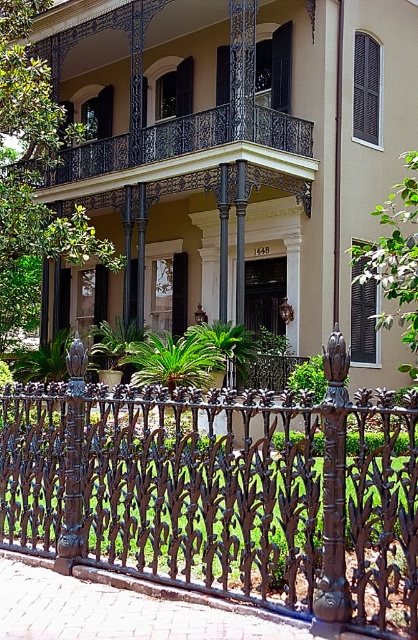
Question: Which of the following is the farthest from the observer?

Choices:
 (A) (306, 189)
 (B) (336, 388)

Answer: (A)

Question: Among these points, which one is farthest from the camera?

Choices:
 (A) (160, 147)
 (B) (333, 420)

Answer: (A)

Question: Can you confirm if black wrought iron fence at lower center is positioned to the right of polished bronze post at center?

Choices:
 (A) no
 (B) yes

Answer: (A)

Question: Is black wrought iron fence at lower center wider than black wrought iron balcony at upper center?

Choices:
 (A) yes
 (B) no

Answer: (B)

Question: Which point is closer to the camera?

Choices:
 (A) (338, 419)
 (B) (303, 476)

Answer: (A)

Question: Does black wrought iron balcony at upper center appear on the right side of polished bronze post at center?

Choices:
 (A) yes
 (B) no

Answer: (B)